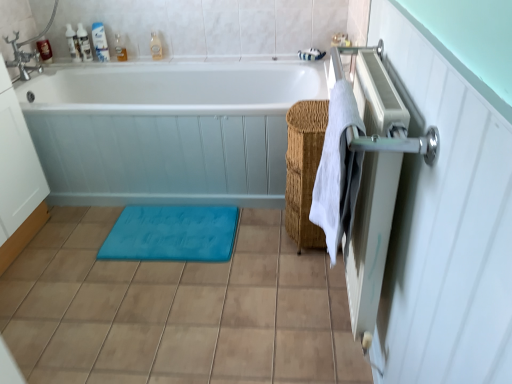
The height and width of the screenshot is (384, 512). What are the coordinates of `vacant area that lies in front of blue rubber bath mat at center` in the screenshot? It's located at (156, 294).